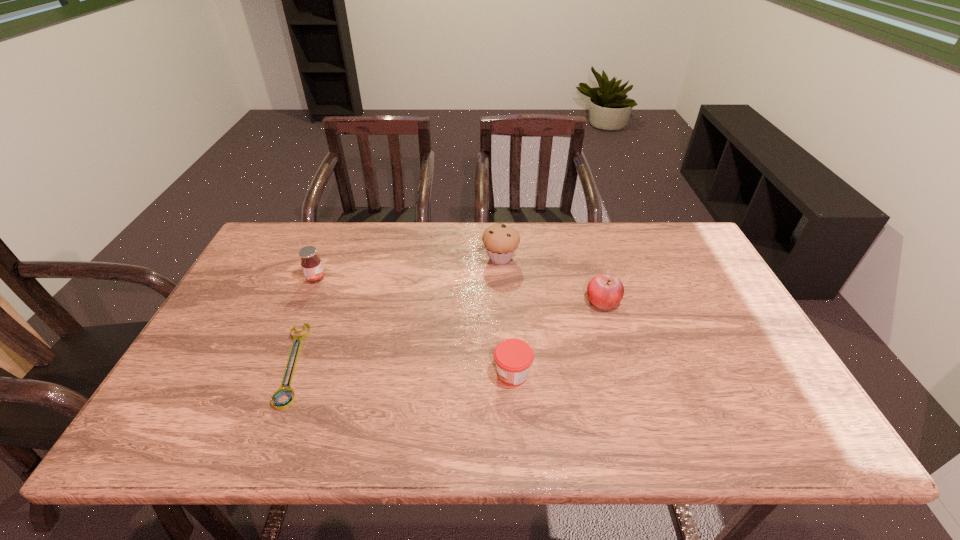
Find the location of a particular element. This screenshot has width=960, height=540. vacant space situated 0.080m on the back of the apple is located at coordinates (594, 272).

This screenshot has width=960, height=540. I want to click on vacant region located on the label side of the shorter jam, so click(451, 373).

Image resolution: width=960 pixels, height=540 pixels. In order to click on free location located 0.200m on the label side of the shorter jam in this screenshot , I will do `click(410, 373)`.

The height and width of the screenshot is (540, 960). What are the coordinates of `free point located on the label side of the shorter jam` in the screenshot? It's located at (455, 373).

Find the location of a particular element. The height and width of the screenshot is (540, 960). free space located 0.180m on the right of the shortest object is located at coordinates (382, 364).

Identify the location of object located in the far edge section of the desktop. This screenshot has width=960, height=540. (501, 242).

This screenshot has width=960, height=540. I want to click on vacant space at the far edge of the desktop, so click(x=452, y=233).

In the image, there is a desktop. Identify the location of vacant area at the near edge. (533, 425).

The height and width of the screenshot is (540, 960). In the image, there is a desktop. What are the coordinates of `vacant space at the right edge` in the screenshot? It's located at (726, 307).

You are a GUI agent. You are given a task and a screenshot of the screen. Output one action in this format:
    pyautogui.click(x=<x>, y=<y>)
    Task: Click on the vacant space at the far left corner
    The width and height of the screenshot is (960, 540).
    Given the screenshot: What is the action you would take?
    pyautogui.click(x=300, y=224)